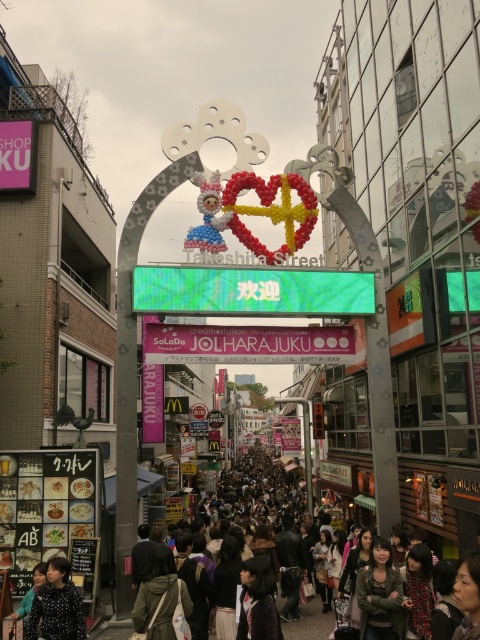
Question: Which of the following is the farthest from the observer?

Choices:
 (A) (162, 324)
 (B) (307, 301)
 (C) (360, 596)
 (D) (249, 461)

Answer: (D)

Question: Observing the image, what is the correct spatial positioning of green matte signboard at center in reference to green textured jacket at lower right?

Choices:
 (A) below
 (B) above

Answer: (B)

Question: In this image, where is polka dot blouse at lower left located relative to dark gray clothing at center?

Choices:
 (A) above
 (B) below

Answer: (A)

Question: Which point is farther to the camera?

Choices:
 (A) green matte signboard at center
 (B) green textured jacket at lower right

Answer: (A)

Question: Does green matte signboard at center appear on the right side of dark gray clothing at center?

Choices:
 (A) no
 (B) yes

Answer: (A)

Question: Which object appears closest to the camera in this image?

Choices:
 (A) dark gray clothing at center
 (B) green textured jacket at lower right

Answer: (B)